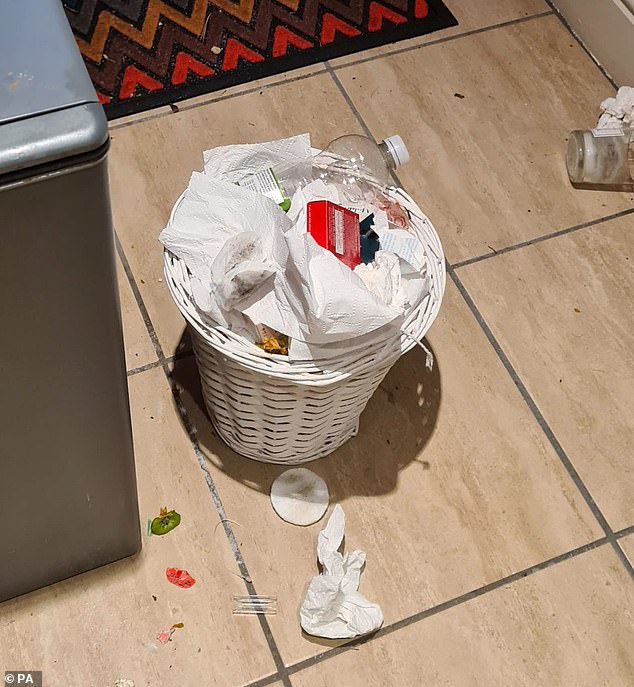
The image size is (634, 687). I want to click on trash laying on grout, so click(358, 624), click(264, 600), click(245, 578), click(623, 106).